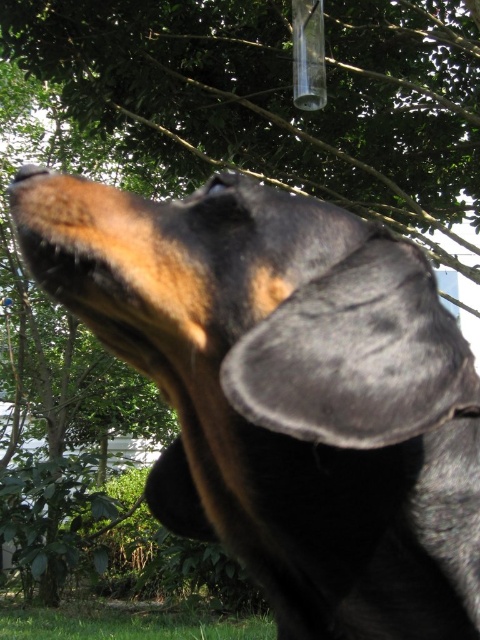
Question: Which object appears closest to the camera in this image?

Choices:
 (A) black fur dog at center
 (B) green grass at lower center

Answer: (A)

Question: Can you confirm if black fur dog at center is smaller than green grass at lower center?

Choices:
 (A) no
 (B) yes

Answer: (B)

Question: Can you confirm if black fur dog at center is bigger than green grass at lower center?

Choices:
 (A) no
 (B) yes

Answer: (A)

Question: Which point is closer to the camera?

Choices:
 (A) (32, 628)
 (B) (338, 308)

Answer: (B)

Question: Where is black fur dog at center located in relation to green grass at lower center in the image?

Choices:
 (A) below
 (B) above

Answer: (B)